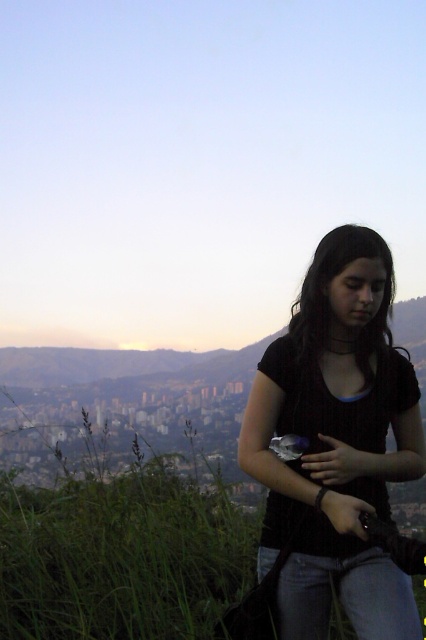
Looking at this image, can you confirm if green grass at lower left is thinner than blue denim jeans at lower right?

No.

Is green grass at lower left taller than blue denim jeans at lower right?

Yes.

Does point (241, 592) come in front of point (322, 586)?

No.

This screenshot has width=426, height=640. I want to click on green grass at lower left, so click(x=120, y=556).

Who is taller, black knitted sweater at center or blue denim jeans at lower right?

Standing taller between the two is black knitted sweater at center.

Can you confirm if black knitted sweater at center is bigger than blue denim jeans at lower right?

Yes, black knitted sweater at center is bigger than blue denim jeans at lower right.

At what (x,y) coordinates should I click in order to perform the action: click on black knitted sweater at center. Please return your answer as a coordinate pair (x, y). The width and height of the screenshot is (426, 640). Looking at the image, I should click on (336, 444).

Locate an element on the screen. This screenshot has width=426, height=640. black knitted sweater at center is located at coordinates (336, 444).

Which is below, black knitted sweater at center or green grass at lower left?

green grass at lower left

Between black knitted sweater at center and green grass at lower left, which one has more height?

black knitted sweater at center

Between point (304, 550) and point (94, 556), which one is positioned in front?

Point (304, 550) is more forward.

Locate an element on the screen. This screenshot has height=640, width=426. black knitted sweater at center is located at coordinates (336, 444).